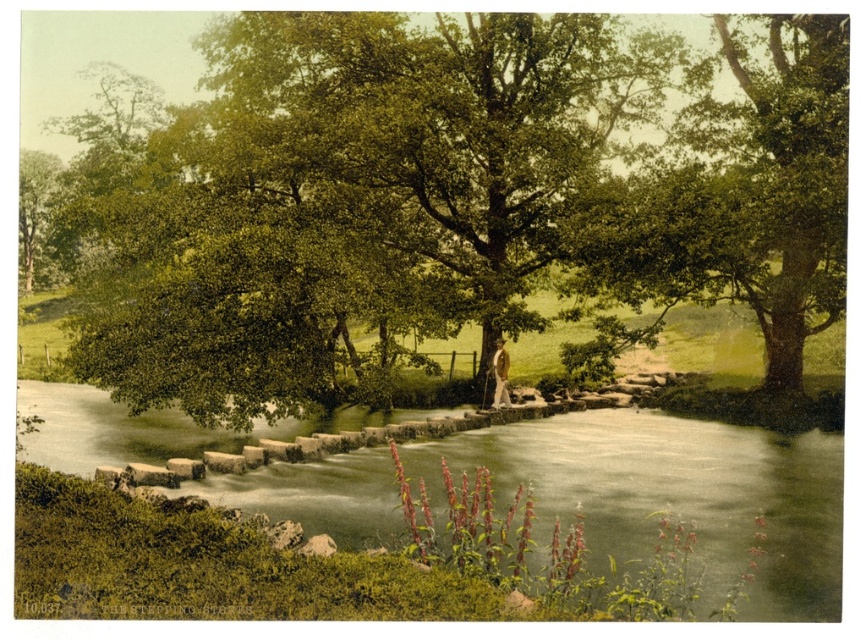
You are standing on the smooth stone steps at center and want to walk towards the green leafy tree at center. Which direction should you face to move closer to the tree?

Since the green leafy tree at center is further to the viewer than the smooth stone steps at center, you should face away from the viewer to walk towards the tree.

You are standing on the stone bridge and looking towards the green leafy tree at upper right. Which direction should you turn to see the green leafy tree at center?

You should turn to your left to see the green leafy tree at center because it is located to the left of the green leafy tree at upper right.

You are standing at the stone bridge and want to take a photo of both the red flowers and the river. The red flowers are located at point (95, 250) and the river is at point (598, 536). Which point is closer to you so you can focus on it first?

Point (95, 250) is closer to you than point (598, 536), so you can focus on it first.